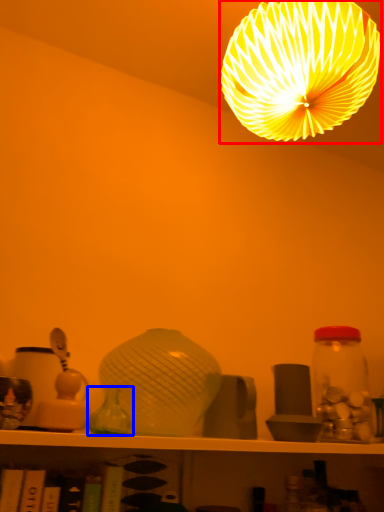
Question: Which object is closer to the camera taking this photo, lamp (highlighted by a red box) or glass vase (highlighted by a blue box)?

Choices:
 (A) lamp
 (B) glass vase

Answer: (A)